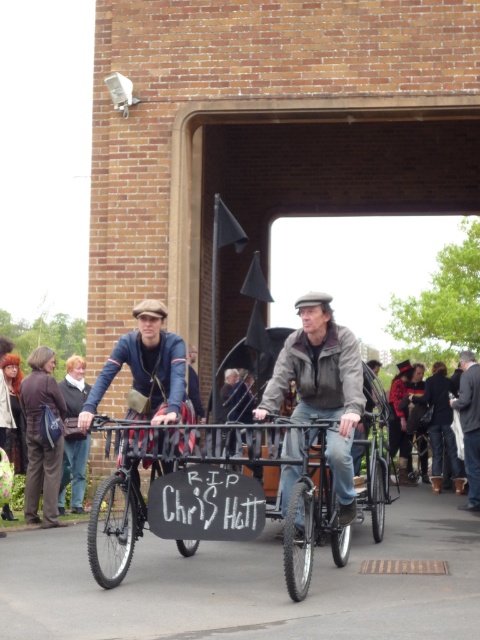
Question: Does leather jacket at center have a smaller size compared to black matte bicycle at center?

Choices:
 (A) yes
 (B) no

Answer: (B)

Question: Which object appears closest to the camera in this image?

Choices:
 (A) matte blue jacket at center
 (B) wooden coach at center

Answer: (A)

Question: Among these objects, which one is nearest to the camera?

Choices:
 (A) wooden coach at center
 (B) black matte bicycle at center

Answer: (B)

Question: Considering the relative positions of leather jacket at center and wooden coach at center in the image provided, where is leather jacket at center located with respect to wooden coach at center?

Choices:
 (A) below
 (B) above

Answer: (B)

Question: Considering the real-world distances, which object is closest to the matte blue jacket at center?

Choices:
 (A) black matte bicycle at center
 (B) wooden coach at center

Answer: (A)

Question: Can you confirm if leather jacket at center is positioned below black matte bicycle at center?

Choices:
 (A) yes
 (B) no

Answer: (B)